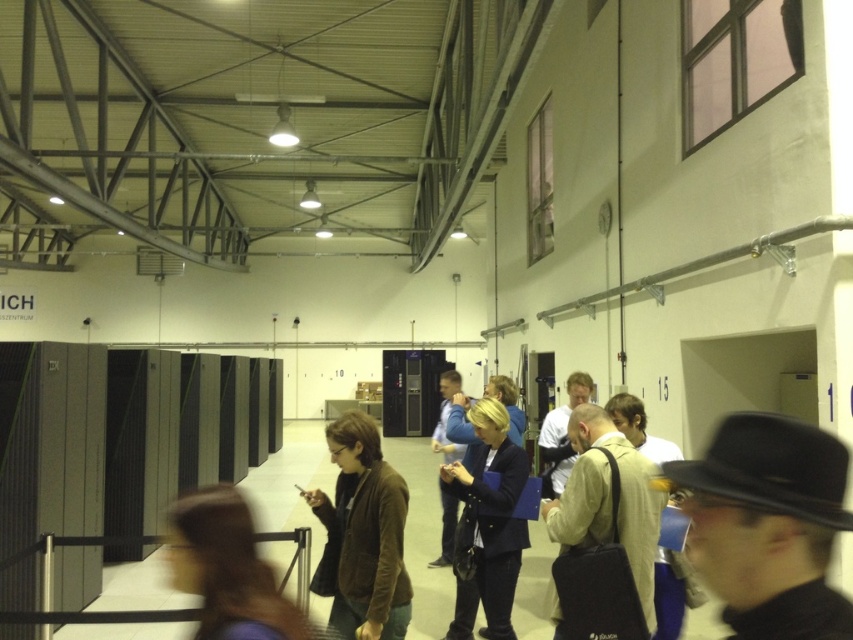
Question: Is the position of brown suede jacket at center more distant than that of dark blue blazer at center?

Choices:
 (A) no
 (B) yes

Answer: (A)

Question: Which object is the closest to the brown suede jacket at center?

Choices:
 (A) dark blue blazer at center
 (B) blue fabric jacket at center
 (C) light brown leather jacket at center

Answer: (A)

Question: Which object is the farthest from the brown suede jacket at center?

Choices:
 (A) light beige fabric shirt at center
 (B) black leather hat at lower right
 (C) brown leather jacket at center
 (D) dark blue blazer at center

Answer: (B)

Question: Is light beige fabric shirt at center to the right of dark blue blazer at center from the viewer's perspective?

Choices:
 (A) no
 (B) yes

Answer: (B)

Question: Among these objects, which one is farthest from the camera?

Choices:
 (A) brown suede jacket at center
 (B) light brown leather jacket at center
 (C) brown leather jacket at center
 (D) dark blue blazer at center

Answer: (B)

Question: Does black leather hat at lower right appear on the right side of brown leather jacket at center?

Choices:
 (A) no
 (B) yes

Answer: (B)